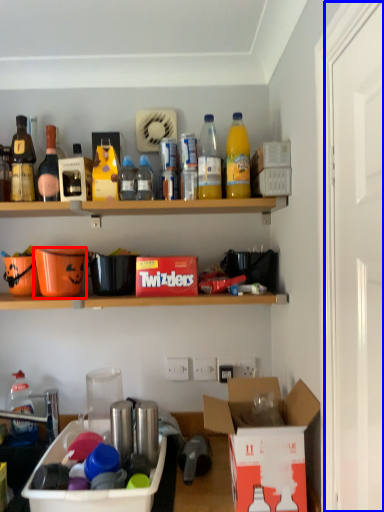
Question: Among these objects, which one is nearest to the camera, bucket (highlighted by a red box) or door (highlighted by a blue box)?

Choices:
 (A) bucket
 (B) door

Answer: (B)